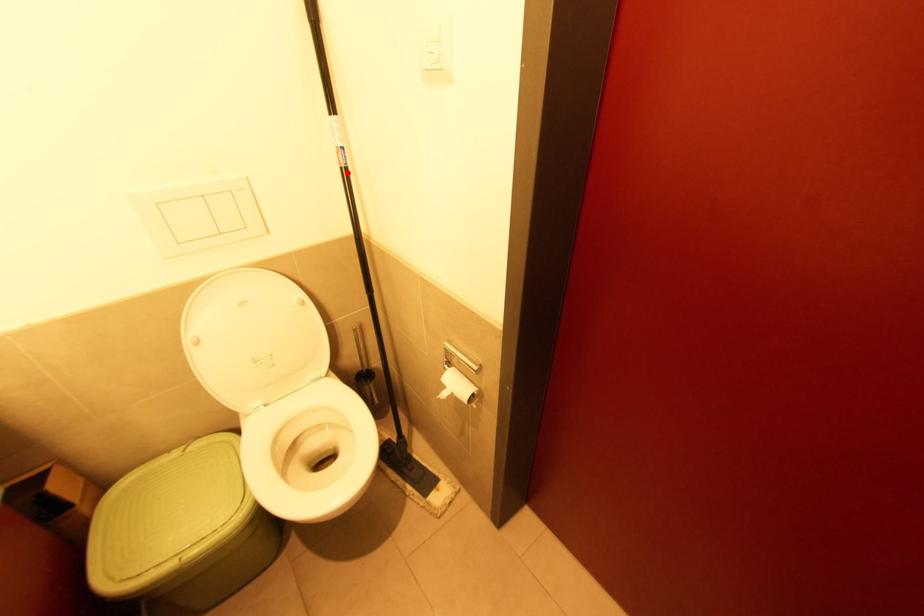
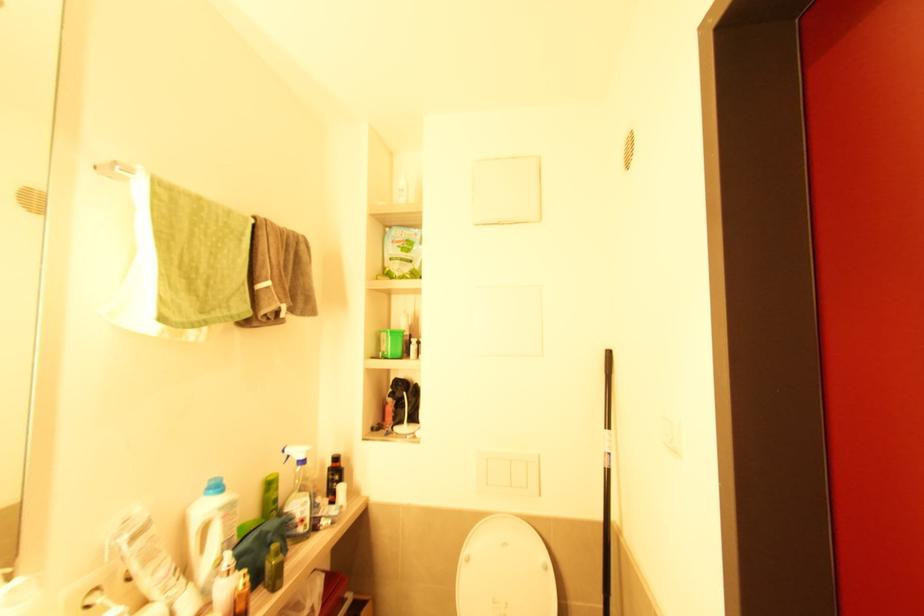
The point at the highlighted location is marked in the first image. Where is the corresponding point in the second image?

(610, 472)